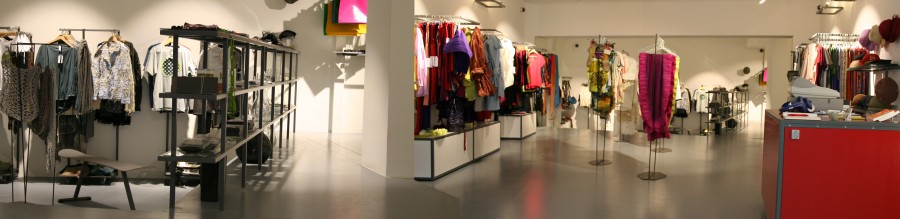
Locate an element on the screen. The height and width of the screenshot is (219, 900). cash register is located at coordinates (810, 91).